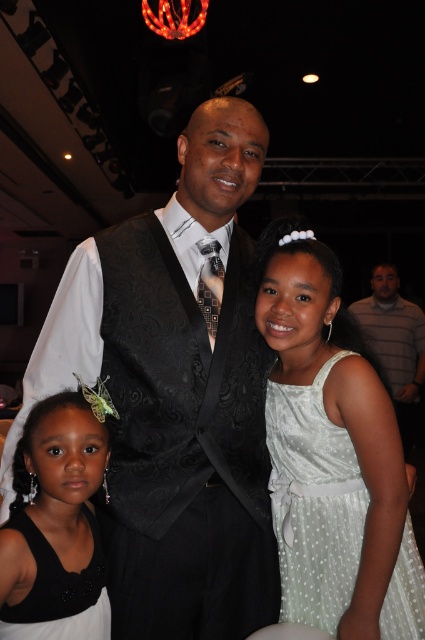
From the picture: You are standing at the center of the banquet hall and want to find the black satin dress at lower left. According to the coordinates provided, in which direction should you look to locate it?

The black satin dress at lower left is located at point (56, 528), which means you should look to your lower left direction to find it.

You are a photographer at the event and need to capture a shot that includes both the white dotted fabric dress at center and the black satin dress at lower left. Based on their positions, which dress should you focus on first to ensure both are in frame?

The white dotted fabric dress at center is positioned over the black satin dress at lower left, so focusing on the white dotted fabric dress at center first will ensure both are in frame as the black satin dress at lower left is beneath it.